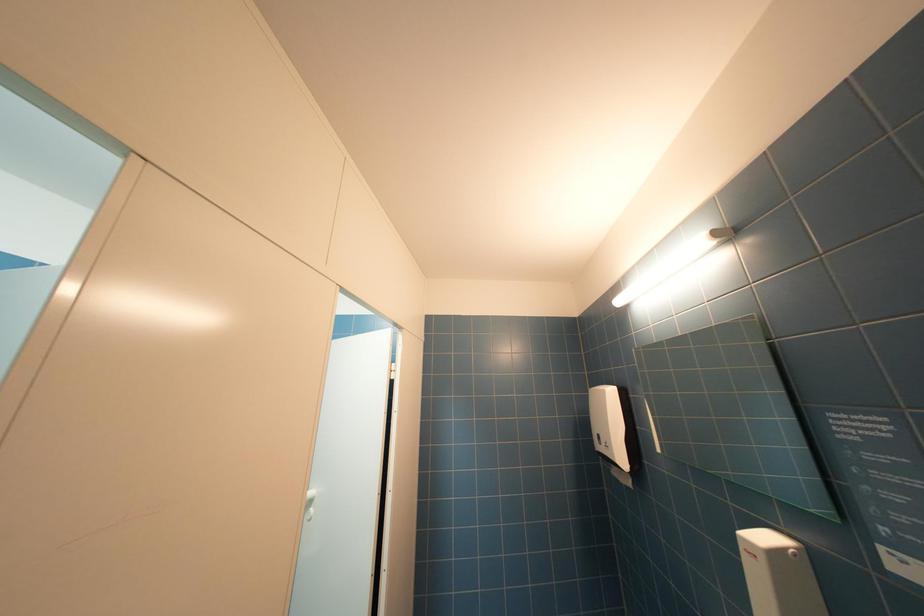
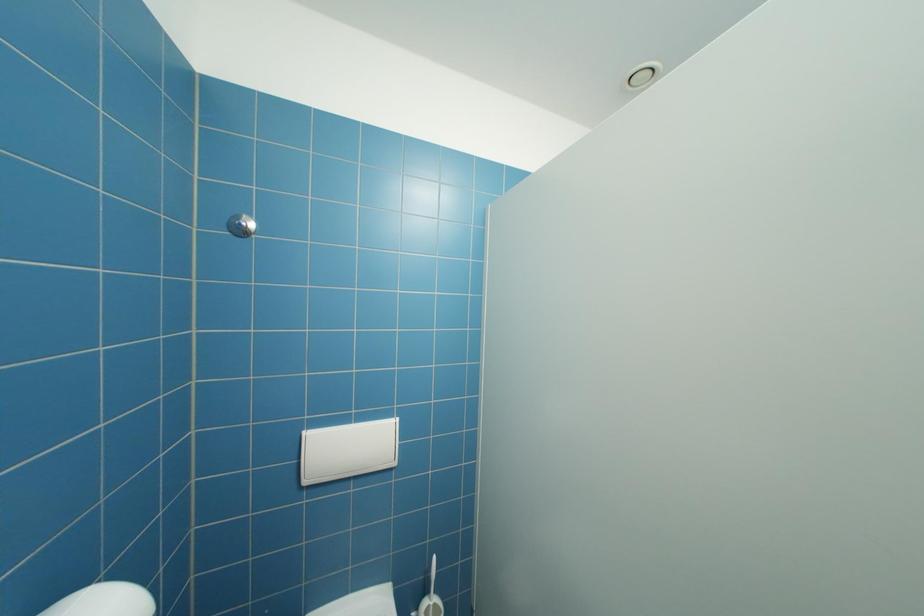
Question: The images are taken continuously from a first-person perspective. In which direction is your viewpoint rotating?

Choices:
 (A) Left
 (B) Right
 (C) Up
 (D) Down

Answer: (A)